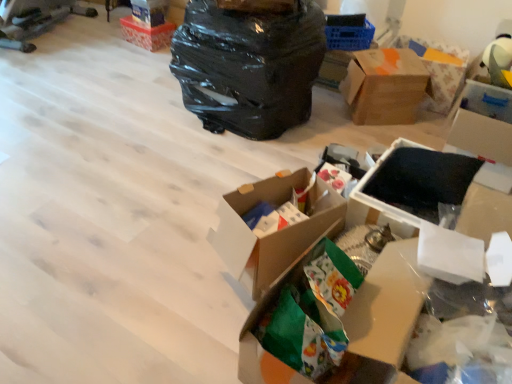
You are a GUI agent. You are given a task and a screenshot of the screen. Output one action in this format:
    pyautogui.click(x=<x>, y=<y>)
    Task: Click on the unoccupied area in front of orange cardboard box at upper left, the 5th box from the right
    
    Given the screenshot: What is the action you would take?
    pyautogui.click(x=135, y=55)